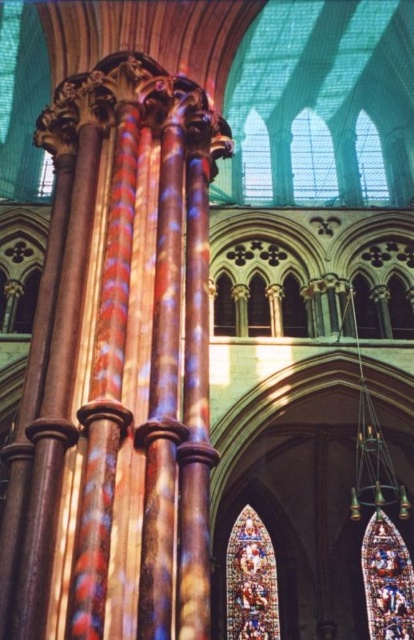
Question: Is the position of stained glass window at upper center less distant than that of stained glass window at upper left?

Choices:
 (A) no
 (B) yes

Answer: (B)

Question: Which is nearer to the stained glass window at center?

Choices:
 (A) multicolored stained glass at lower right
 (B) stained glass window at upper center
 (C) stained glass window at upper left

Answer: (A)

Question: Which of the following is the farthest from the observer?

Choices:
 (A) multicolored stained glass at lower right
 (B) stained glass window at upper left
 (C) stained glass window at upper center

Answer: (B)

Question: Can you confirm if stained glass window at upper center is bigger than multicolored stained glass at lower right?

Choices:
 (A) no
 (B) yes

Answer: (B)

Question: Which object is closer to the camera taking this photo?

Choices:
 (A) stained glass window at upper center
 (B) stained glass window at upper left
 (C) multicolored stained glass at lower right
 (D) stained glass window at center

Answer: (A)

Question: Can you confirm if stained glass window at upper center is smaller than stained glass window at center?

Choices:
 (A) no
 (B) yes

Answer: (A)